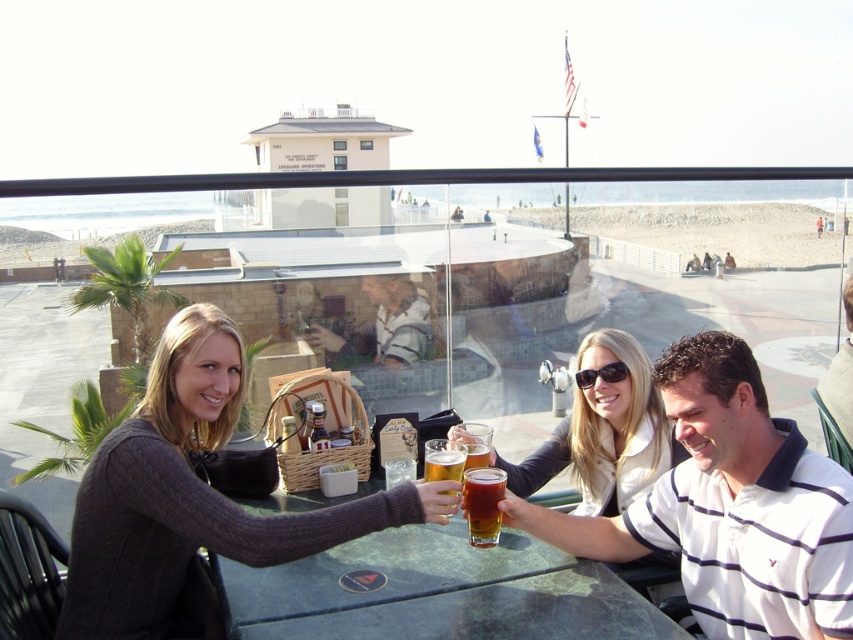
Can you confirm if amber glass beer at center is smaller than translucent glass beer at center?

Correct, amber glass beer at center occupies less space than translucent glass beer at center.

The image size is (853, 640). I want to click on amber glass beer at center, so click(x=482, y=504).

Measure the distance between white striped polo shirt at center and green marble table at center.

white striped polo shirt at center and green marble table at center are 13.92 inches apart from each other.

In the scene shown: Which is above, white striped polo shirt at center or green marble table at center?

white striped polo shirt at center is higher up.

Between point (672, 376) and point (393, 634), which one is positioned behind?

Positioned behind is point (672, 376).

What are the coordinates of `white striped polo shirt at center` in the screenshot? It's located at (730, 506).

Where is `white striped polo shirt at right`? The image size is (853, 640). white striped polo shirt at right is located at coordinates (840, 376).